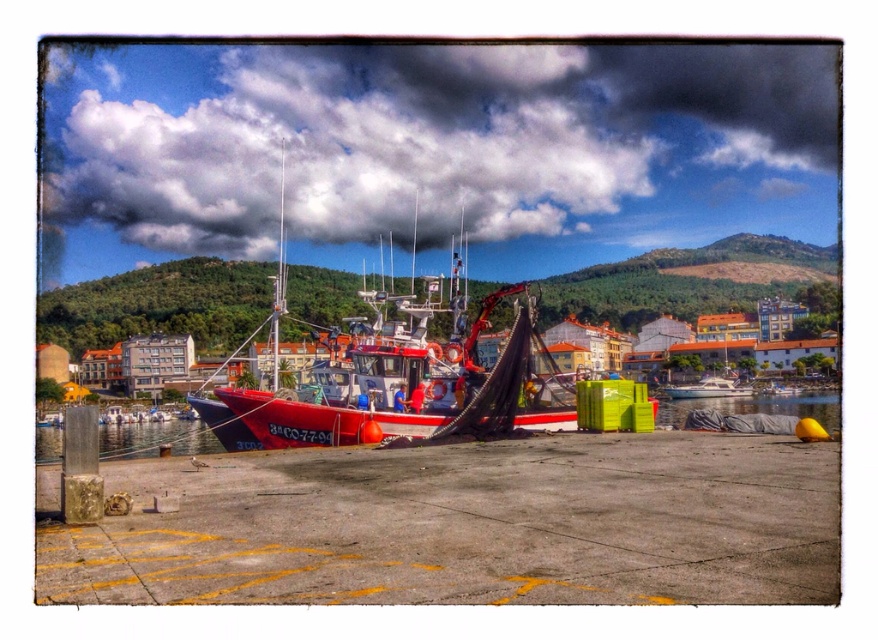
You are a dock worker who needs to secure the black tarp at lower right. Based on its position, can you confirm if it is placed near the edge of the dock where the yellow markings begin?

The black tarp at lower right is located at point (x=754, y=406), which is near the edge of the dock where the yellow markings begin. Therefore, it is properly positioned for securing.

You are a photographer planning to take a photo of the white glossy boat at center and the black tarp at lower right. Based on their sizes in the image, which object will appear larger in the final photo?

The black tarp at lower right will appear larger in the photo because it is much taller than the white glossy boat at center.

You are standing at the edge of the dock and want to retrieve the black tarp at lower right. Considering the distance, can you reach it by walking straight ahead without leaving the dock?

The black tarp at lower right is 245.55 feet away from the viewer. Since the dock is a concrete structure with yellow markings indicating parking or loading zones, it is likely that the dock extends far enough to allow you to walk straight ahead to reach the black tarp at lower right without leaving the dock.